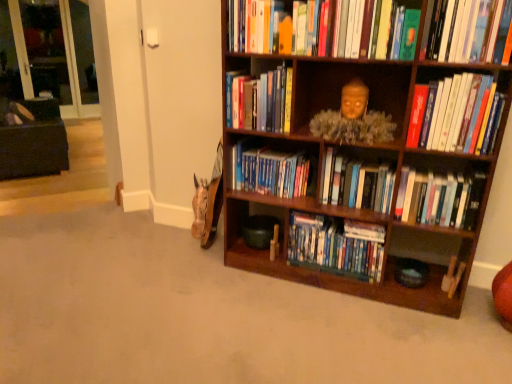
Question: Considering the relative positions of hardcover books at upper right, which appears as the 3th book when viewed from the top, and hardcover books at center right, the sixth book positioned from the top, in the image provided, is hardcover books at upper right, which appears as the 3th book when viewed from the top, behind hardcover books at center right, the sixth book positioned from the top,?

Choices:
 (A) yes
 (B) no

Answer: (B)

Question: Can you confirm if hardcover books at upper right, which appears as the 3th book when viewed from the top, is bigger than hardcover books at center right, which appears as the second book when ordered from the bottom?

Choices:
 (A) yes
 (B) no

Answer: (A)

Question: Could you tell me if hardcover books at upper right, which appears as the 3th book when viewed from the top, is facing hardcover books at center right, which appears as the second book when ordered from the bottom?

Choices:
 (A) yes
 (B) no

Answer: (B)

Question: Is hardcover books at upper right, the fifth book when ordered from bottom to top, thinner than hardcover books at center right, the sixth book positioned from the top?

Choices:
 (A) no
 (B) yes

Answer: (A)

Question: Can you confirm if hardcover books at upper right, the fifth book when ordered from bottom to top, is positioned to the right of hardcover books at center right, which appears as the second book when ordered from the bottom?

Choices:
 (A) yes
 (B) no

Answer: (A)

Question: In terms of size, does hardcover books at center right, the sixth book positioned from the top, appear bigger or smaller than blue hardcover books at center, arranged as the 4th book when ordered from the bottom?

Choices:
 (A) small
 (B) big

Answer: (A)

Question: Would you say hardcover books at center right, the sixth book positioned from the top, is inside or outside blue hardcover books at center, arranged as the 4th book when ordered from the bottom?

Choices:
 (A) outside
 (B) inside

Answer: (A)

Question: In the image, is hardcover books at center right, which appears as the second book when ordered from the bottom, positioned in front of or behind blue hardcover books at center, placed as the 4th book when sorted from top to bottom?

Choices:
 (A) front
 (B) behind

Answer: (A)

Question: Is point click(424, 192) positioned closer to the camera than point click(270, 183)?

Choices:
 (A) closer
 (B) farther

Answer: (A)

Question: Do you think hardcover books at upper right, which appears as the 3th book when viewed from the top, is within hardcover books at center, which is the third book from bottom to top, or outside of it?

Choices:
 (A) inside
 (B) outside

Answer: (B)

Question: From the image's perspective, relative to hardcover books at center, which is the third book from bottom to top, is hardcover books at upper right, which appears as the 3th book when viewed from the top, above or below?

Choices:
 (A) below
 (B) above

Answer: (B)

Question: Is point (487, 135) closer or farther from the camera than point (382, 198)?

Choices:
 (A) farther
 (B) closer

Answer: (B)

Question: Is hardcover books at upper right, which appears as the 3th book when viewed from the top, bigger or smaller than hardcover books at center, which is the third book from bottom to top?

Choices:
 (A) big
 (B) small

Answer: (A)

Question: Is dark brown fabric bean bag chair at left bigger or smaller than transparent glass door at upper left, arranged as the second glass door when viewed from the right?

Choices:
 (A) big
 (B) small

Answer: (A)

Question: From a real-world perspective, is dark brown fabric bean bag chair at left positioned above or below transparent glass door at upper left, arranged as the second glass door when viewed from the right?

Choices:
 (A) below
 (B) above

Answer: (A)